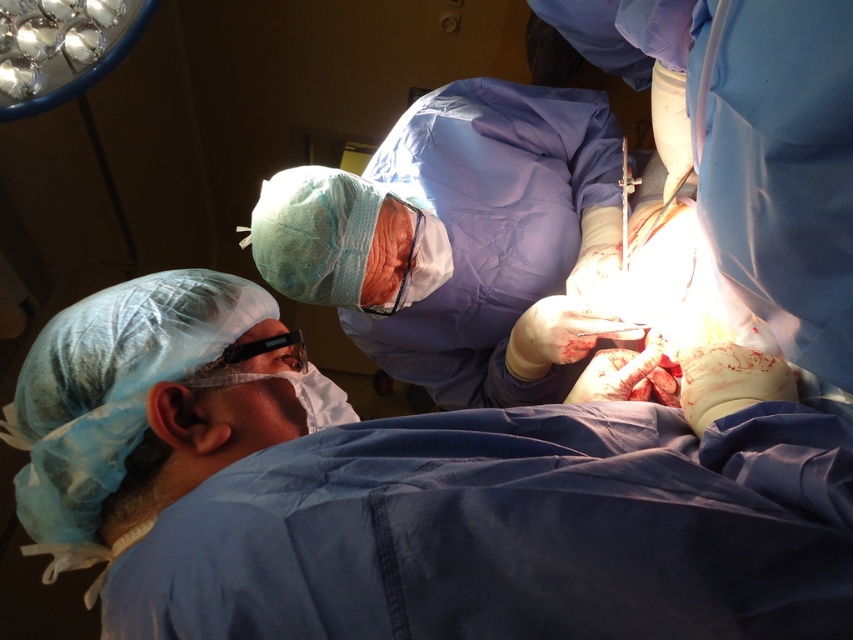
Question: Can you confirm if purple smooth gown at center is positioned to the right of metallic silver scalpel at upper center?

Choices:
 (A) yes
 (B) no

Answer: (B)

Question: Which point is closer to the camera?

Choices:
 (A) (622, 260)
 (B) (480, 342)

Answer: (A)

Question: Does purple smooth gown at center appear under metallic silver scalpel at upper center?

Choices:
 (A) no
 (B) yes

Answer: (B)

Question: Is purple smooth gown at center below metallic silver scalpel at upper center?

Choices:
 (A) no
 (B) yes

Answer: (B)

Question: Which of the following is the farthest from the observer?

Choices:
 (A) metallic silver scalpel at upper center
 (B) purple smooth gown at center

Answer: (A)

Question: Which point is farther to the camera?

Choices:
 (A) (627, 154)
 (B) (454, 129)

Answer: (A)